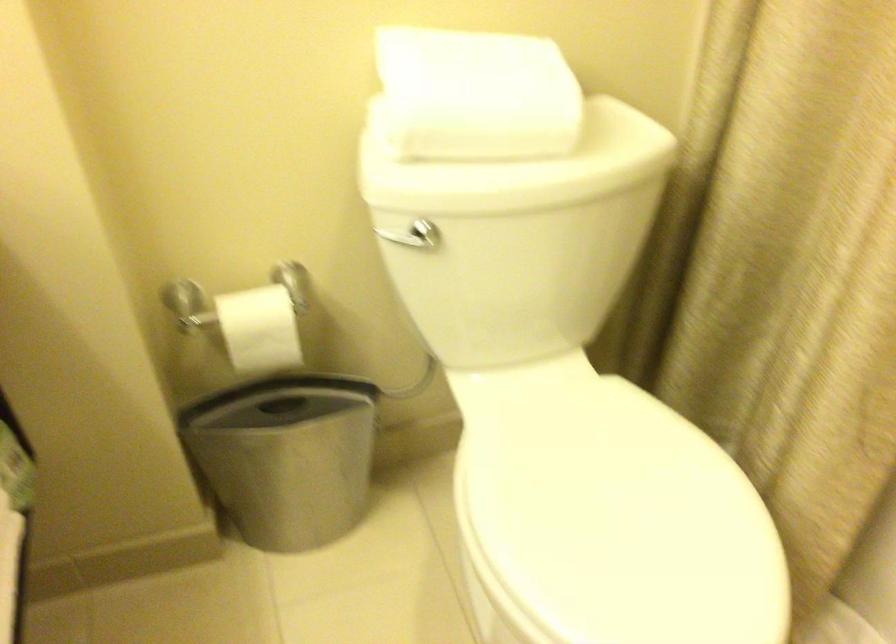
Find the location of a particular element. The image size is (896, 644). toilet flush handle is located at coordinates (410, 241).